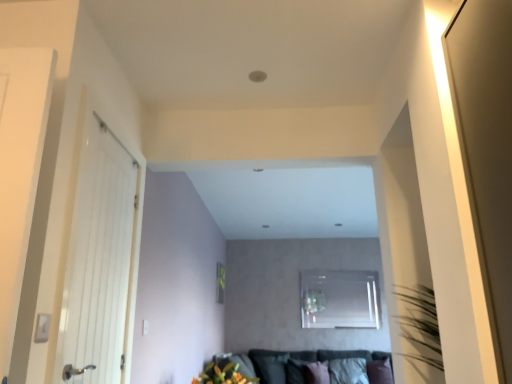
Describe the element at coordinates (223, 375) in the screenshot. I see `vibrant orange flowers at lower center` at that location.

Describe the element at coordinates (272, 368) in the screenshot. I see `black fabric pillow at lower center, arranged as the 3th pillow when viewed from the right` at that location.

What do you see at coordinates (300, 368) in the screenshot? This screenshot has height=384, width=512. I see `velvet dark grey couch at lower center` at bounding box center [300, 368].

The height and width of the screenshot is (384, 512). What are the coordinates of `white fabric pillow at lower center, which appears as the second pillow when viewed from the left` in the screenshot? It's located at (348, 371).

The width and height of the screenshot is (512, 384). I want to click on transparent glass window at center, so (339, 299).

Locate an element on the screen. purple velvet pillow at lower right, positioned as the 3th pillow in left-to-right order is located at coordinates (379, 371).

This screenshot has height=384, width=512. Identify the location of vibrant orange flowers at lower center. (223, 375).

Find the location of a particular element. The height and width of the screenshot is (384, 512). floral arrangement above the purple velvet pillow at lower right, which is the first pillow in right-to-left order (from a real-world perspective) is located at coordinates (223, 375).

Which is correct: purple velvet pillow at lower right, which is the first pillow in right-to-left order, is inside vibrant orange flowers at lower center, or outside of it?

purple velvet pillow at lower right, which is the first pillow in right-to-left order, is located beyond the bounds of vibrant orange flowers at lower center.

Is purple velvet pillow at lower right, which is the first pillow in right-to-left order, thinner than vibrant orange flowers at lower center?

Indeed, purple velvet pillow at lower right, which is the first pillow in right-to-left order, has a lesser width compared to vibrant orange flowers at lower center.

From the image's perspective, which one is positioned lower, white wooden door at left or purple velvet pillow at lower right, which is the first pillow in right-to-left order?

purple velvet pillow at lower right, which is the first pillow in right-to-left order, from the image's perspective.

From a real-world perspective, which object stands above the other?

In real-world perspective, white wooden door at left is above.

Considering the positions of objects white wooden door at left and purple velvet pillow at lower right, which is the first pillow in right-to-left order, in the image provided, who is more to the right, white wooden door at left or purple velvet pillow at lower right, which is the first pillow in right-to-left order,?

purple velvet pillow at lower right, which is the first pillow in right-to-left order.

Is transparent glass window at center bigger than white fabric pillow at lower center, which is counted as the second pillow, starting from the right?

Incorrect, transparent glass window at center is not larger than white fabric pillow at lower center, which is counted as the second pillow, starting from the right.

Identify the location of window located above the white fabric pillow at lower center, which appears as the second pillow when viewed from the left (from the image's perspective). (339, 299).

Could you tell me if transparent glass window at center is turned towards white fabric pillow at lower center, which appears as the second pillow when viewed from the left?

No, transparent glass window at center is not aimed at white fabric pillow at lower center, which appears as the second pillow when viewed from the left.

From the image's perspective, relative to white fabric pillow at lower center, which is counted as the second pillow, starting from the right, is transparent glass window at center above or below?

Based on their image positions, transparent glass window at center is located above white fabric pillow at lower center, which is counted as the second pillow, starting from the right.

In the scene shown: Does black fabric pillow at lower center, which is the first pillow in left-to-right order, touch velvet dark grey couch at lower center?

black fabric pillow at lower center, which is the first pillow in left-to-right order, and velvet dark grey couch at lower center are not in contact.

Is black fabric pillow at lower center, arranged as the 3th pillow when viewed from the right, situated inside velvet dark grey couch at lower center or outside?

black fabric pillow at lower center, arranged as the 3th pillow when viewed from the right, can be found inside velvet dark grey couch at lower center.

Is black fabric pillow at lower center, arranged as the 3th pillow when viewed from the right, wider or thinner than velvet dark grey couch at lower center?

In the image, black fabric pillow at lower center, arranged as the 3th pillow when viewed from the right, appears to be more narrow than velvet dark grey couch at lower center.

Is point (287, 353) positioned after point (298, 383)?

Yes, it is behind point (298, 383).

Is vibrant orange flowers at lower center positioned beyond the bounds of velvet dark grey couch at lower center?

vibrant orange flowers at lower center is positioned outside velvet dark grey couch at lower center.

Is vibrant orange flowers at lower center not close to velvet dark grey couch at lower center?

Yes, vibrant orange flowers at lower center and velvet dark grey couch at lower center are located far from each other.

Looking at their sizes, would you say vibrant orange flowers at lower center is wider or thinner than velvet dark grey couch at lower center?

Considering their sizes, vibrant orange flowers at lower center looks slimmer than velvet dark grey couch at lower center.

What are the coordinates of `floral arrangement that appears on the left of velvet dark grey couch at lower center` in the screenshot? It's located at (223, 375).

Does point (213, 380) come in front of point (193, 378)?

No.

From a real-world perspective, who is located higher, velvet dark grey couch at lower center or vibrant orange flowers at lower center?

vibrant orange flowers at lower center is physically above.

Is velvet dark grey couch at lower center facing away from vibrant orange flowers at lower center?

velvet dark grey couch at lower center is not turned away from vibrant orange flowers at lower center.

Would you consider vibrant orange flowers at lower center to be distant from purple velvet pillow at lower right, which is the first pillow in right-to-left order?

Yes.

Can you confirm if vibrant orange flowers at lower center is shorter than purple velvet pillow at lower right, positioned as the 3th pillow in left-to-right order?

Indeed, vibrant orange flowers at lower center has a lesser height compared to purple velvet pillow at lower right, positioned as the 3th pillow in left-to-right order.

Considering the sizes of objects vibrant orange flowers at lower center and purple velvet pillow at lower right, which is the first pillow in right-to-left order, in the image provided, who is wider, vibrant orange flowers at lower center or purple velvet pillow at lower right, which is the first pillow in right-to-left order,?

vibrant orange flowers at lower center is wider.

How many degrees apart are the facing directions of vibrant orange flowers at lower center and purple velvet pillow at lower right, positioned as the 3th pillow in left-to-right order?

87.5 degrees.

Identify the location of floral arrangement above the purple velvet pillow at lower right, positioned as the 3th pillow in left-to-right order (from the image's perspective). Image resolution: width=512 pixels, height=384 pixels. (223, 375).

This screenshot has width=512, height=384. In order to click on door lying in front of the purple velvet pillow at lower right, which is the first pillow in right-to-left order in this screenshot , I will do `click(99, 262)`.

From the image, which object appears to be nearer to transparent glass window at center, velvet dark grey couch at lower center or white fabric pillow at lower center, which is counted as the second pillow, starting from the right?

Based on the image, velvet dark grey couch at lower center appears to be nearer to transparent glass window at center.

Estimate the real-world distances between objects in this image. Which object is closer to purple velvet pillow at lower right, positioned as the 3th pillow in left-to-right order, transparent glass window at center or white wooden door at left?

Based on the image, transparent glass window at center appears to be nearer to purple velvet pillow at lower right, positioned as the 3th pillow in left-to-right order.

Estimate the real-world distances between objects in this image. Which object is further from purple velvet pillow at lower right, positioned as the 3th pillow in left-to-right order, transparent glass window at center or black fabric pillow at lower center, which is the first pillow in left-to-right order?

black fabric pillow at lower center, which is the first pillow in left-to-right order.

From the picture: Considering their positions, is velvet dark grey couch at lower center positioned closer to transparent glass window at center than black fabric pillow at lower center, arranged as the 3th pillow when viewed from the right?

velvet dark grey couch at lower center is closer to transparent glass window at center.

Looking at the image, which one is located closer to white fabric pillow at lower center, which is counted as the second pillow, starting from the right, purple velvet pillow at lower right, positioned as the 3th pillow in left-to-right order, or white wooden door at left?

The object closer to white fabric pillow at lower center, which is counted as the second pillow, starting from the right, is purple velvet pillow at lower right, positioned as the 3th pillow in left-to-right order.

Looking at the image, which one is located closer to white fabric pillow at lower center, which appears as the second pillow when viewed from the left, transparent glass window at center or velvet dark grey couch at lower center?

velvet dark grey couch at lower center is positioned closer to the anchor white fabric pillow at lower center, which appears as the second pillow when viewed from the left.

Considering their positions, is velvet dark grey couch at lower center positioned closer to vibrant orange flowers at lower center than white fabric pillow at lower center, which is counted as the second pillow, starting from the right?

velvet dark grey couch at lower center is closer to vibrant orange flowers at lower center.

Considering their positions, is velvet dark grey couch at lower center positioned further to black fabric pillow at lower center, arranged as the 3th pillow when viewed from the right, than purple velvet pillow at lower right, which is the first pillow in right-to-left order?

purple velvet pillow at lower right, which is the first pillow in right-to-left order, is positioned further to the anchor black fabric pillow at lower center, arranged as the 3th pillow when viewed from the right.

You are a GUI agent. You are given a task and a screenshot of the screen. Output one action in this format:
    pyautogui.click(x=<x>, y=<y>)
    Task: Click on the pillow positioned between vibrant orange flowers at lower center and black fabric pillow at lower center, arranged as the 3th pillow when viewed from the right, from near to far
    Image resolution: width=512 pixels, height=384 pixels.
    Given the screenshot: What is the action you would take?
    pyautogui.click(x=379, y=371)

Locate an element on the screen. couch between white wooden door at left and white fabric pillow at lower center, which appears as the second pillow when viewed from the left, along the z-axis is located at coordinates (300, 368).

You are a GUI agent. You are given a task and a screenshot of the screen. Output one action in this format:
    pyautogui.click(x=<x>, y=<y>)
    Task: Click on the pillow between black fabric pillow at lower center, arranged as the 3th pillow when viewed from the right, and purple velvet pillow at lower right, positioned as the 3th pillow in left-to-right order, from left to right
    
    Given the screenshot: What is the action you would take?
    pyautogui.click(x=348, y=371)

The height and width of the screenshot is (384, 512). Identify the location of couch located between vibrant orange flowers at lower center and black fabric pillow at lower center, arranged as the 3th pillow when viewed from the right, in the depth direction. (300, 368).